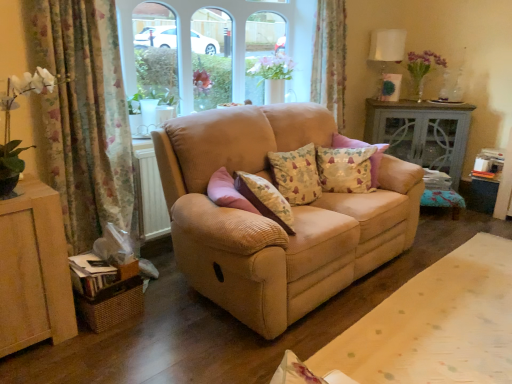
The height and width of the screenshot is (384, 512). What do you see at coordinates (84, 115) in the screenshot?
I see `floral fabric curtain at left, the first curtain when ordered from front to back` at bounding box center [84, 115].

Locate an element on the screen. This screenshot has height=384, width=512. floral fabric curtain at upper center, which is the first curtain from back to front is located at coordinates (330, 58).

What do you see at coordinates (426, 327) in the screenshot? The image size is (512, 384). I see `beige fabric sofa at center` at bounding box center [426, 327].

You are a GUI agent. You are given a task and a screenshot of the screen. Output one action in this format:
    pyautogui.click(x=<x>, y=<y>)
    Task: Click on the floral fabric pillow at center, the 1th pillow from the right
    This screenshot has height=384, width=512.
    Given the screenshot: What is the action you would take?
    pyautogui.click(x=345, y=169)

What do you see at coordinates (345, 169) in the screenshot? Image resolution: width=512 pixels, height=384 pixels. I see `floral fabric pillow at center, the 1th pillow from the right` at bounding box center [345, 169].

Locate an element on the screen. This screenshot has height=384, width=512. clear glass window at center is located at coordinates (232, 43).

Is floral fabric pillow at center, the 1th pillow from the right, in contact with matte gray cabinet at right?

No, floral fabric pillow at center, the 1th pillow from the right, is not in contact with matte gray cabinet at right.

Between point (331, 186) and point (403, 126), which one is positioned in front?

The point (331, 186) is in front.

Does floral fabric pillow at center, which is counted as the second pillow, starting from the left, turn towards matte gray cabinet at right?

No, floral fabric pillow at center, which is counted as the second pillow, starting from the left, is not turned towards matte gray cabinet at right.

Measure the distance between floral fabric pillow at center, which is counted as the second pillow, starting from the left, and matte gray cabinet at right.

floral fabric pillow at center, which is counted as the second pillow, starting from the left, and matte gray cabinet at right are 1.41 meters apart from each other.

Consider the image. From the image's perspective, is floral fabric pillow at center, which is counted as the second pillow, starting from the left, positioned above or below beige corduroy couch at center?

floral fabric pillow at center, which is counted as the second pillow, starting from the left, is situated higher than beige corduroy couch at center in the image.

Can you confirm if floral fabric pillow at center, which is counted as the second pillow, starting from the left, is positioned to the right of beige corduroy couch at center?

Yes, floral fabric pillow at center, which is counted as the second pillow, starting from the left, is to the right of beige corduroy couch at center.

Could you tell me if matte gray cabinet at right is turned towards floral fabric pillow at center, the 1th pillow from the right?

Yes, matte gray cabinet at right is aimed at floral fabric pillow at center, the 1th pillow from the right.

Looking at this image, considering the relative positions of matte gray cabinet at right and floral fabric pillow at center, the 1th pillow from the right, in the image provided, is matte gray cabinet at right behind floral fabric pillow at center, the 1th pillow from the right,?

That is True.

Measure the distance from matte gray cabinet at right to floral fabric pillow at center, the 1th pillow from the right.

matte gray cabinet at right is 4.63 feet away from floral fabric pillow at center, the 1th pillow from the right.

From a real-world perspective, relative to floral fabric pillow at center, the 1th pillow from the right, is matte gray cabinet at right vertically above or below?

matte gray cabinet at right is below floral fabric pillow at center, the 1th pillow from the right.

Considering the positions of point (308, 159) and point (378, 40), is point (308, 159) closer or farther from the camera than point (378, 40)?

Point (308, 159) is positioned closer to the camera compared to point (378, 40).

From the image's perspective, is floral fabric cushion at center, which is counted as the 2th pillow, starting from the right, beneath white fabric lampshade at upper right?

Correct, floral fabric cushion at center, which is counted as the 2th pillow, starting from the right, appears lower than white fabric lampshade at upper right in the image.

In terms of size, does floral fabric cushion at center, which is counted as the 2th pillow, starting from the right, appear bigger or smaller than white fabric lampshade at upper right?

floral fabric cushion at center, which is counted as the 2th pillow, starting from the right, is smaller than white fabric lampshade at upper right.

Is there a large distance between floral fabric cushion at center, which is the first pillow from left to right, and white fabric lampshade at upper right?

Absolutely, floral fabric cushion at center, which is the first pillow from left to right, is distant from white fabric lampshade at upper right.

Would you say white fabric lampshade at upper right contains beige corduroy couch at center?

No, beige corduroy couch at center is not inside white fabric lampshade at upper right.

From the image's perspective, which object appears higher, white fabric lampshade at upper right or beige corduroy couch at center?

white fabric lampshade at upper right, from the image's perspective.

In terms of height, does white fabric lampshade at upper right look taller or shorter compared to beige corduroy couch at center?

Considering their sizes, white fabric lampshade at upper right has less height than beige corduroy couch at center.

Looking at this image, can you tell me how much white fabric lampshade at upper right and beige corduroy couch at center differ in facing direction?

48.3 degrees separate the facing orientations of white fabric lampshade at upper right and beige corduroy couch at center.

From the image's perspective, which is above, floral fabric cushion at center, which is counted as the 2th pillow, starting from the right, or floral fabric curtain at left, the 1th curtain viewed from the left?

From the image's view, floral fabric curtain at left, the 1th curtain viewed from the left, is above.

Is floral fabric cushion at center, which is the first pillow from left to right, facing towards floral fabric curtain at left, arranged as the 2th curtain when viewed from the right?

No, floral fabric cushion at center, which is the first pillow from left to right, is not turned towards floral fabric curtain at left, arranged as the 2th curtain when viewed from the right.

Is floral fabric cushion at center, which is the first pillow from left to right, at the right side of floral fabric curtain at left, arranged as the 2th curtain when viewed from the right?

Correct, you'll find floral fabric cushion at center, which is the first pillow from left to right, to the right of floral fabric curtain at left, arranged as the 2th curtain when viewed from the right.

Which of these two, floral fabric curtain at upper center, placed as the first curtain when sorted from right to left, or floral fabric curtain at left, acting as the second curtain starting from the back, is thinner?

With smaller width is floral fabric curtain at left, acting as the second curtain starting from the back.

From a real-world perspective, is floral fabric curtain at upper center, which is the 2th curtain in front-to-back order, over floral fabric curtain at left, arranged as the 2th curtain when viewed from the right?

Yes, from a real-world perspective, floral fabric curtain at upper center, which is the 2th curtain in front-to-back order, is above floral fabric curtain at left, arranged as the 2th curtain when viewed from the right.

Is floral fabric curtain at upper center, which appears as the 2th curtain when viewed from the left, in contact with floral fabric curtain at left, arranged as the 2th curtain when viewed from the right?

floral fabric curtain at upper center, which appears as the 2th curtain when viewed from the left, and floral fabric curtain at left, arranged as the 2th curtain when viewed from the right, are not in contact.

Does point (343, 91) come behind point (57, 52)?

Yes, point (343, 91) is behind point (57, 52).

From a real-world perspective, starting from the matte gray cabinet at right, which pillow is the 2nd one vertically above it? Please provide its 2D coordinates.

[(345, 169)]

Identify the location of the 2nd pillow counting from the right side of the beige corduroy couch at center. Image resolution: width=512 pixels, height=384 pixels. (345, 169).

Looking at the image, which one is located further to beige corduroy couch at center, beige fabric sofa at center or floral fabric pillow at center, the 1th pillow from the right?

beige fabric sofa at center lies further to beige corduroy couch at center than the other object.

Based on their spatial positions, is beige fabric sofa at center or matte gray cabinet at right closer to floral fabric pillow at center, the 1th pillow from the right?

beige fabric sofa at center lies closer to floral fabric pillow at center, the 1th pillow from the right, than the other object.

Based on the photo, based on their spatial positions, is floral fabric curtain at left, acting as the second curtain starting from the back, or beige corduroy couch at center further from floral fabric pillow at center, the 1th pillow from the right?

floral fabric curtain at left, acting as the second curtain starting from the back.

Looking at the image, which one is located closer to floral fabric curtain at left, the first curtain when ordered from front to back, matte gray cabinet at right or beige corduroy couch at center?

Among the two, beige corduroy couch at center is located nearer to floral fabric curtain at left, the first curtain when ordered from front to back.

When comparing their distances from matte gray cabinet at right, does beige fabric sofa at center or beige corduroy couch at center seem further?

Based on the image, beige corduroy couch at center appears to be further to matte gray cabinet at right.

Considering their positions, is beige corduroy couch at center positioned further to floral fabric curtain at left, the first curtain when ordered from front to back, than matte gray cabinet at right?

The object further to floral fabric curtain at left, the first curtain when ordered from front to back, is matte gray cabinet at right.

Looking at this image, when comparing their distances from white fabric lampshade at upper right, does clear glass window at center or floral fabric cushion at center, which is the first pillow from left to right, seem closer?

clear glass window at center is closer to white fabric lampshade at upper right.

From the image, which object appears to be farther from beige corduroy couch at center, clear glass window at center or beige fabric sofa at center?

clear glass window at center.

What are the coordinates of `window between floral fabric curtain at left, arranged as the 2th curtain when viewed from the right, and floral fabric curtain at upper center, placed as the first curtain when sorted from right to left, in the horizontal direction` in the screenshot? It's located at pos(232,43).

Where is `window between beige corduroy couch at center and white fabric lampshade at upper right in the front-back direction`? Image resolution: width=512 pixels, height=384 pixels. window between beige corduroy couch at center and white fabric lampshade at upper right in the front-back direction is located at coordinates (232, 43).

I want to click on studio couch between floral fabric curtain at left, acting as the second curtain starting from the back, and floral fabric pillow at center, which is counted as the second pillow, starting from the left, in the horizontal direction, so click(272, 221).

You are a GUI agent. You are given a task and a screenshot of the screen. Output one action in this format:
    pyautogui.click(x=<x>, y=<y>)
    Task: Click on the window between floral fabric curtain at left, the first curtain when ordered from front to back, and matte gray cabinet at right from left to right
    Image resolution: width=512 pixels, height=384 pixels.
    Given the screenshot: What is the action you would take?
    pyautogui.click(x=232, y=43)